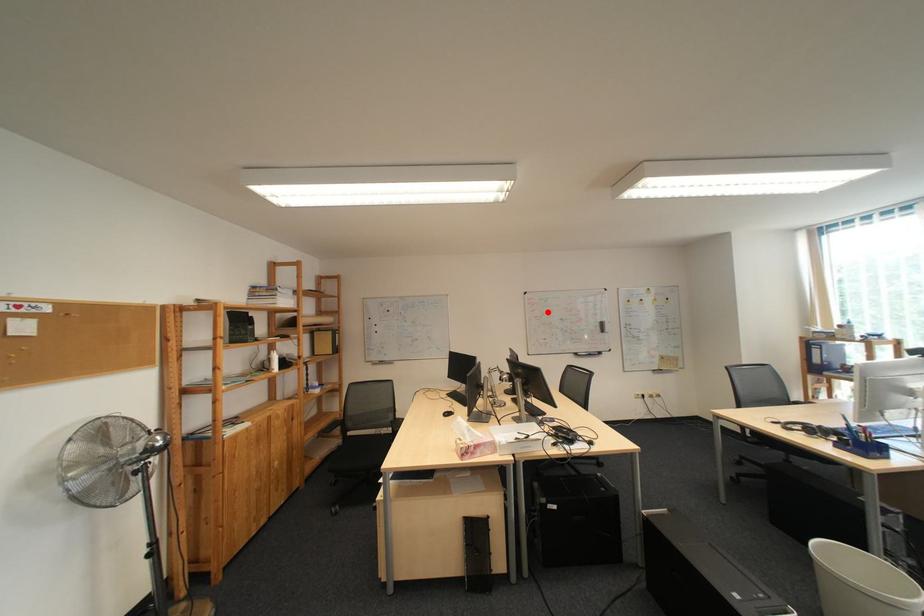
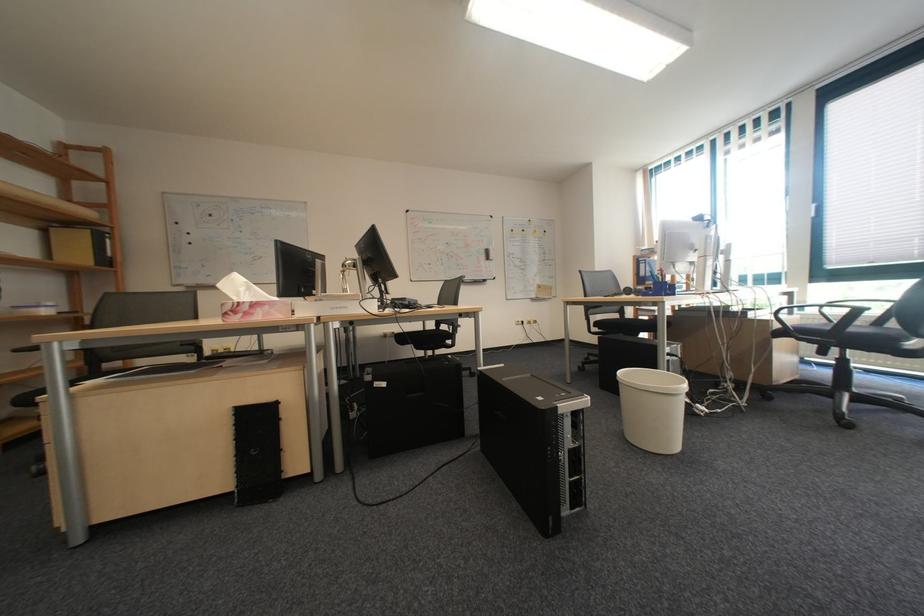
Find the pixel in the second image that matches the highlighted location in the first image.

(431, 233)